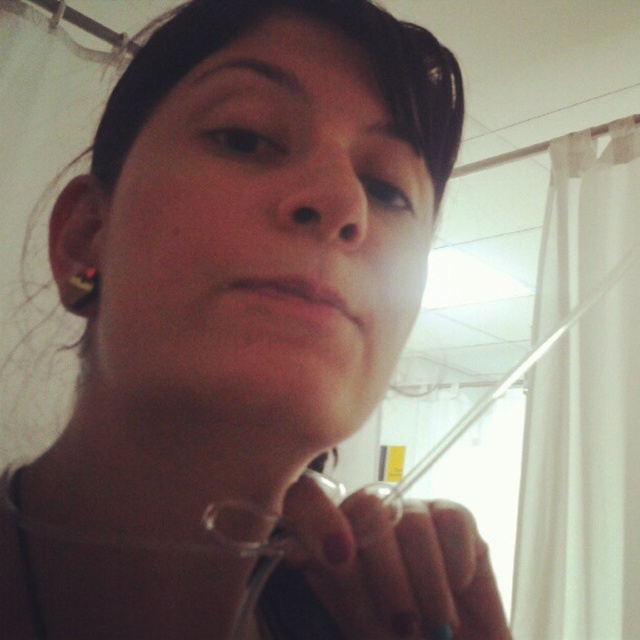
Does matte skin nose at center appear on the left side of gold shiny earring at left ear?

In fact, matte skin nose at center is to the right of gold shiny earring at left ear.

Is matte skin nose at center further to camera compared to gold shiny earring at left ear?

No, it is not.

Is point (349, 172) positioned behind point (67, 296)?

No, (349, 172) is in front of (67, 296).

The width and height of the screenshot is (640, 640). Identify the location of matte skin nose at center. (323, 198).

Is clear plastic tube at lower center positioned at the back of matte skin nose at center?

That is True.

Which is behind, point (385, 580) or point (307, 216)?

Positioned behind is point (385, 580).

Where is `clear plastic tube at lower center`? clear plastic tube at lower center is located at coordinates (394, 564).

The width and height of the screenshot is (640, 640). What do you see at coordinates (394, 564) in the screenshot? I see `clear plastic tube at lower center` at bounding box center [394, 564].

You are a GUI agent. You are given a task and a screenshot of the screen. Output one action in this format:
    pyautogui.click(x=<x>, y=<y>)
    Task: Click on the clear plastic tube at lower center
    The height and width of the screenshot is (640, 640).
    Given the screenshot: What is the action you would take?
    pyautogui.click(x=394, y=564)